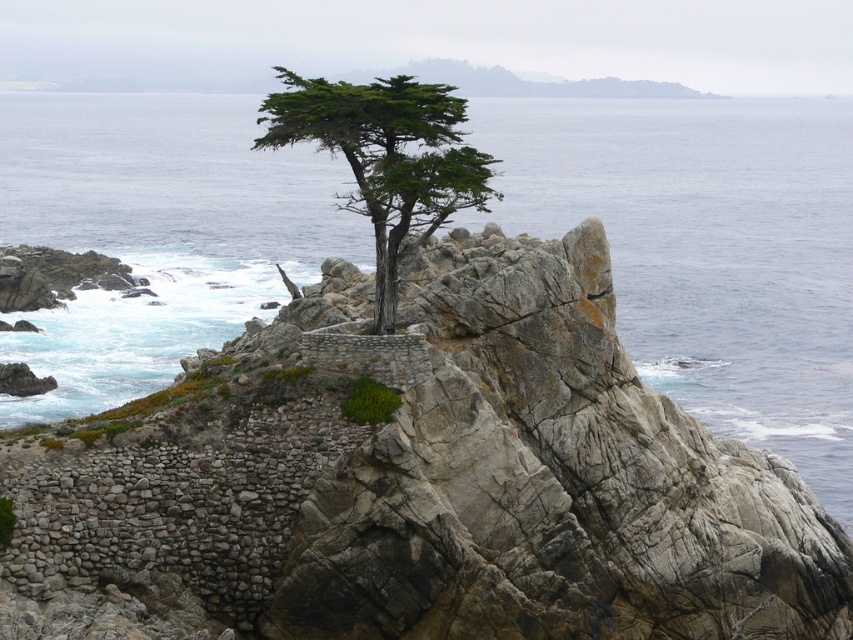
Does blue water at upper center appear on the right side of green textured tree at center?

In fact, blue water at upper center is to the left of green textured tree at center.

Locate an element on the screen. blue water at upper center is located at coordinates (706, 252).